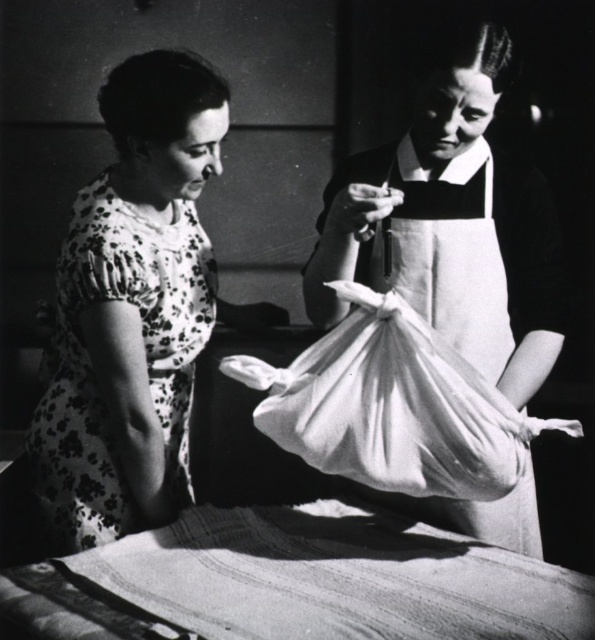
Question: Which object is the farthest from the white fabric bag at center?

Choices:
 (A) floral print dress at left
 (B) white fabric at center
 (C) textured fabric bed at lower center

Answer: (C)

Question: Does white fabric bag at center have a lesser width compared to white fabric at center?

Choices:
 (A) yes
 (B) no

Answer: (A)

Question: Can you confirm if white fabric bag at center is smaller than floral print dress at left?

Choices:
 (A) no
 (B) yes

Answer: (A)

Question: Which object is the farthest from the white fabric at center?

Choices:
 (A) floral print dress at left
 (B) textured fabric bed at lower center

Answer: (A)

Question: Does white fabric bag at center have a lesser width compared to floral print dress at left?

Choices:
 (A) yes
 (B) no

Answer: (B)

Question: Which point is closer to the camera?

Choices:
 (A) (339, 314)
 (B) (192, 301)
 (C) (193, 577)
 (D) (277, 412)

Answer: (C)